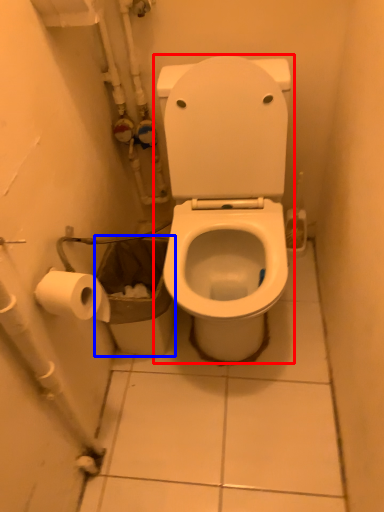
Question: Which point is closer to the camera, toilet (highlighted by a red box) or garbage (highlighted by a blue box)?

Choices:
 (A) toilet
 (B) garbage

Answer: (A)